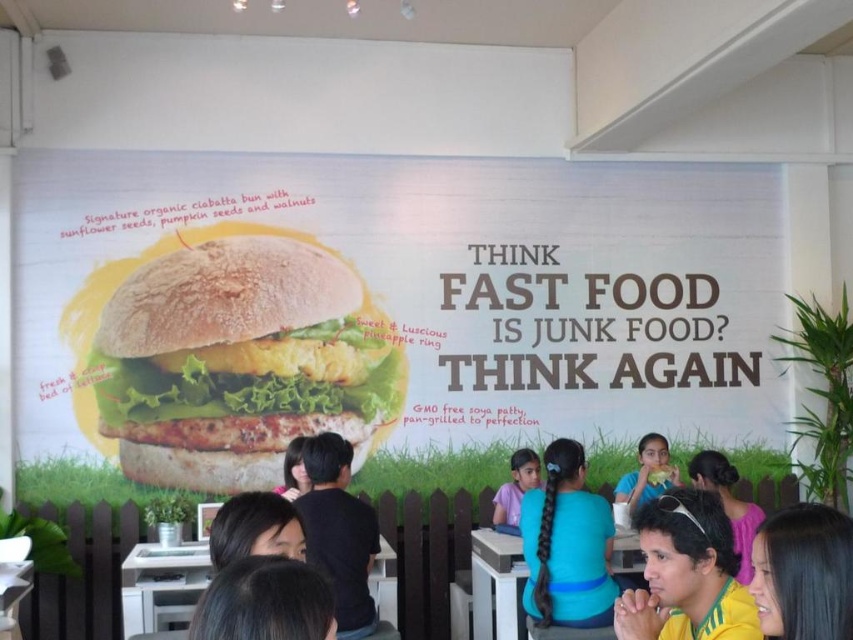
What is the difference between the smooth black hair at lower right and the black hair at lower center in terms of thickness?

The smooth black hair at lower right is thinner than the black hair at lower center.

You are a customer looking to sit at the white plastic table at center. You notice someone with black hair at center is nearby. Based on the size of the table and the person, can you estimate if there is enough space for you to sit comfortably?

The white plastic table at center has a smaller size compared to black hair at center. Since the table is smaller than the person, there might not be enough space for you to sit comfortably.